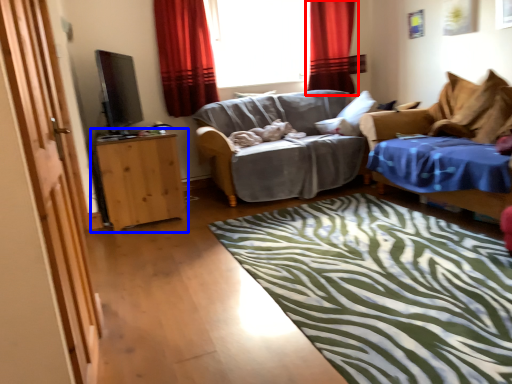
Question: Among these objects, which one is farthest to the camera, curtain (highlighted by a red box) or table (highlighted by a blue box)?

Choices:
 (A) curtain
 (B) table

Answer: (A)